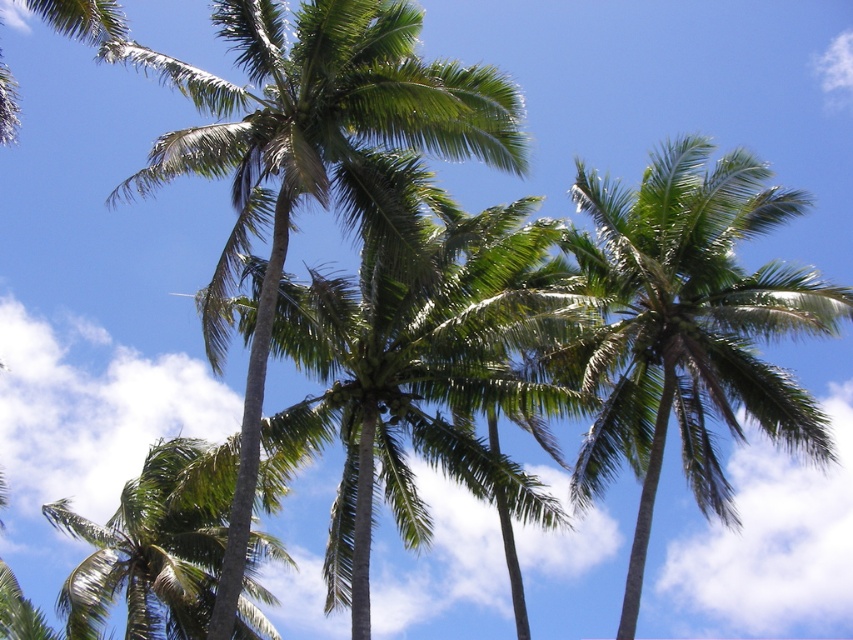
Is green leafy palm tree at upper right to the left of green leafy palm tree at center from the viewer's perspective?

No, green leafy palm tree at upper right is not to the left of green leafy palm tree at center.

Who is lower down, green leafy palm tree at upper right or green leafy palm tree at center?

green leafy palm tree at upper right is lower down.

Based on the photo, who is more forward, [822,316] or [285,131]?

Point [285,131] is more forward.

Locate an element on the screen. green leafy palm tree at upper right is located at coordinates (688, 326).